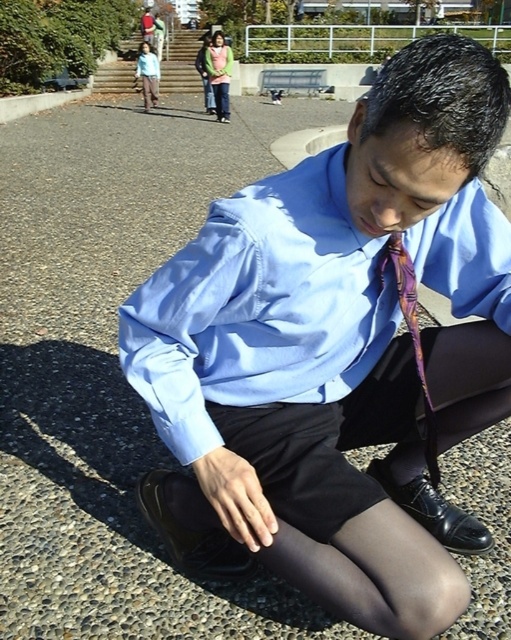
Question: Is matte blue shirt at center positioned before purple silky tie at center?

Choices:
 (A) yes
 (B) no

Answer: (A)

Question: Does matte blue shirt at center have a greater width compared to purple silky tie at center?

Choices:
 (A) yes
 (B) no

Answer: (A)

Question: Can you confirm if matte blue shirt at center is positioned to the left of purple silky tie at center?

Choices:
 (A) no
 (B) yes

Answer: (B)

Question: Which object appears closest to the camera in this image?

Choices:
 (A) matte blue shirt at center
 (B) purple silky tie at center

Answer: (A)